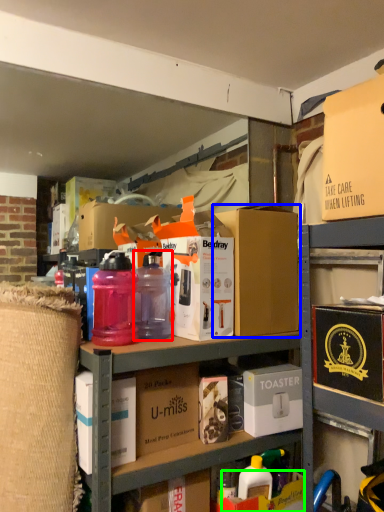
Question: Estimate the real-world distances between objects in this image. Which object is farther from bottle (highlighted by a red box), box (highlighted by a blue box) or storage box (highlighted by a green box)?

Choices:
 (A) box
 (B) storage box

Answer: (B)